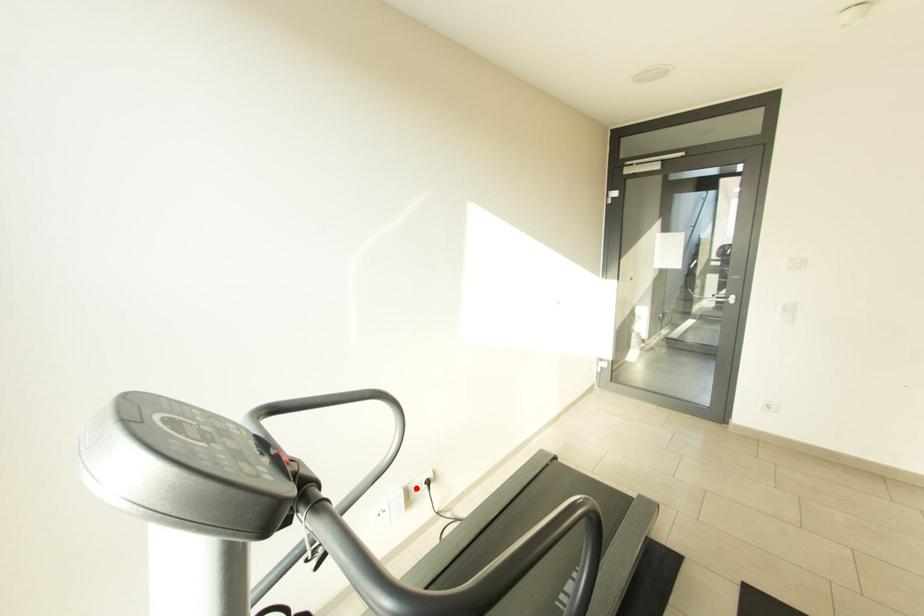
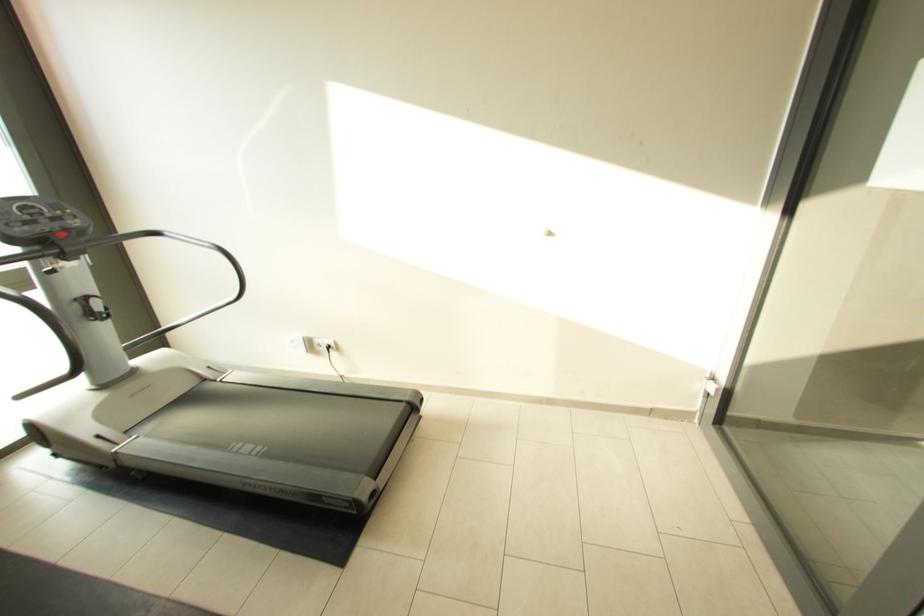
Where in the second image is the point corresponding to the highlighted location from the first image?

(322, 342)